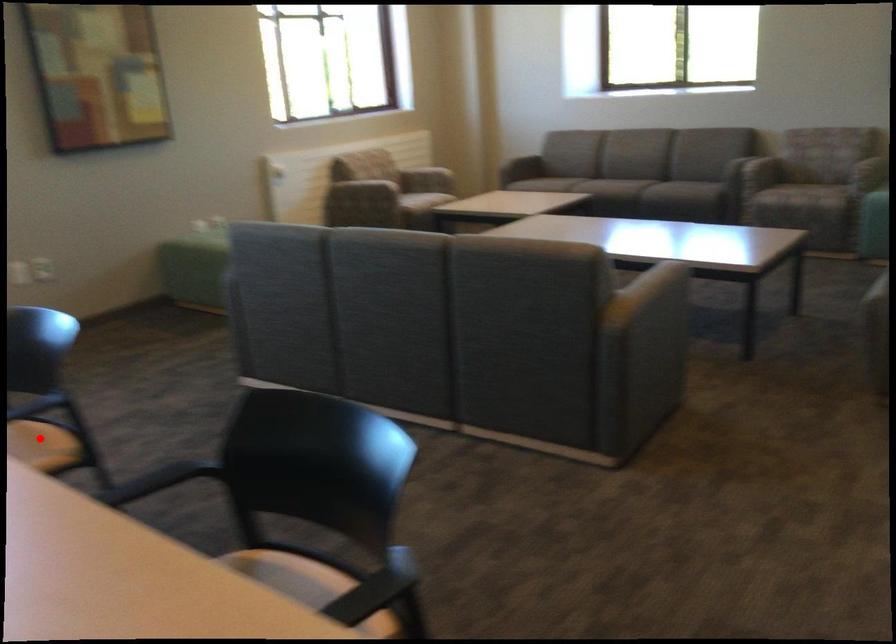
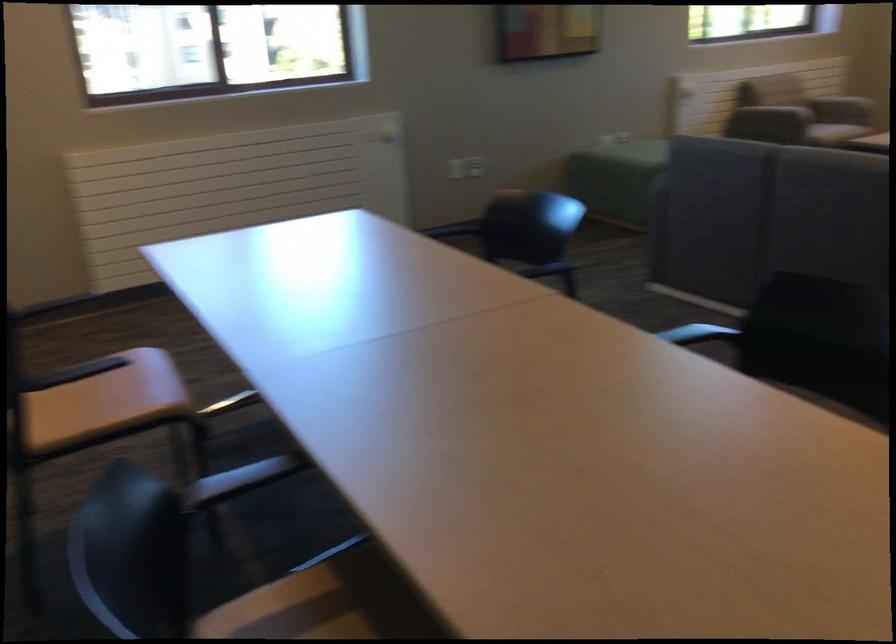
Question: I am providing you with two images of the same scene from different viewpoints. A red point is marked on the first image. Can you still see the location of the red point in image 2?

Choices:
 (A) Yes
 (B) No

Answer: (B)